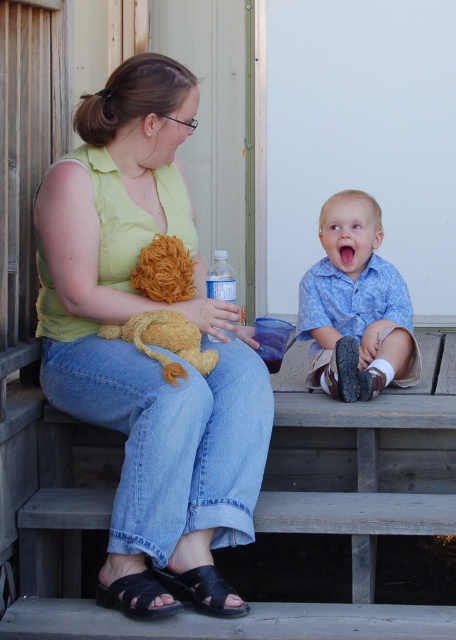
Looking at this image, you are a photographer trying to capture a candid shot of the two people in the scene. You notice the matte yellow shirt at center and the clear plastic bottle at center. Which object should you focus on if you want to include both in your frame but prioritize the one closer to the left side?

The matte yellow shirt at center is to the left of the clear plastic bottle at center, so focusing on the matte yellow shirt at center would prioritize the left side while still including the clear plastic bottle at center in the frame.

You are a photographer trying to capture a candid shot of the matte yellow shirt at center and the clear plastic bottle at center. Which object should you focus on first to ensure both are in frame?

The matte yellow shirt at center is closer to the viewer than the clear plastic bottle at center, so focus on the matte yellow shirt at center first to ensure both are in frame.